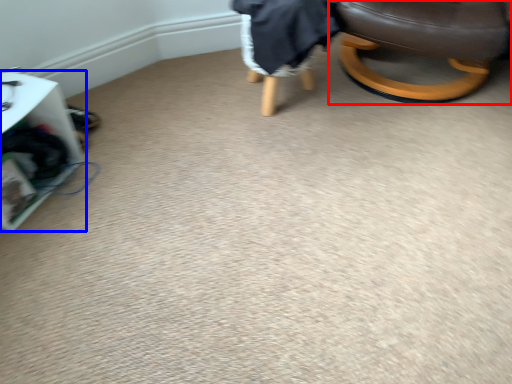
Question: Which of the following is the farthest to the observer, chair (highlighted by a red box) or furniture (highlighted by a blue box)?

Choices:
 (A) chair
 (B) furniture

Answer: (A)